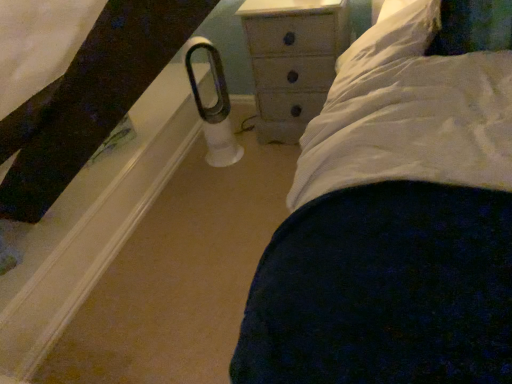
What is the approximate width of light wood chest of drawers at center?

The width of light wood chest of drawers at center is 16.60 inches.

What do you see at coordinates (292, 60) in the screenshot? I see `light wood chest of drawers at center` at bounding box center [292, 60].

At what (x,y) coordinates should I click in order to perform the action: click on light wood chest of drawers at center. Please return your answer as a coordinate pair (x, y). The width and height of the screenshot is (512, 384). Looking at the image, I should click on (292, 60).

You are a GUI agent. You are given a task and a screenshot of the screen. Output one action in this format:
    pyautogui.click(x=<x>, y=<y>)
    Task: Click on the light wood chest of drawers at center
    This screenshot has width=512, height=384.
    Given the screenshot: What is the action you would take?
    pyautogui.click(x=292, y=60)